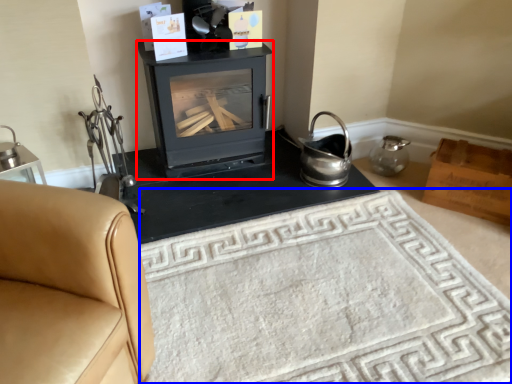
Question: Which of the following is the closest to the observer, wood burning stove (highlighted by a red box) or doormat (highlighted by a blue box)?

Choices:
 (A) wood burning stove
 (B) doormat

Answer: (B)